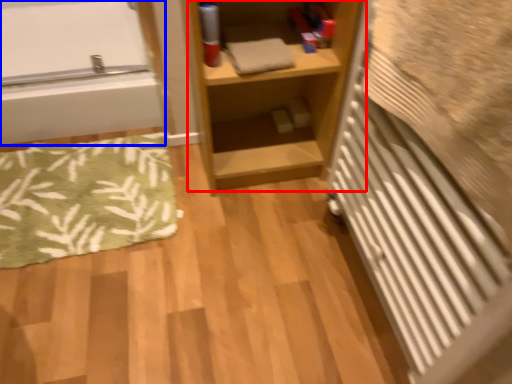
Question: Among these objects, which one is farthest to the camera, shelf (highlighted by a red box) or bathtub (highlighted by a blue box)?

Choices:
 (A) shelf
 (B) bathtub

Answer: (B)